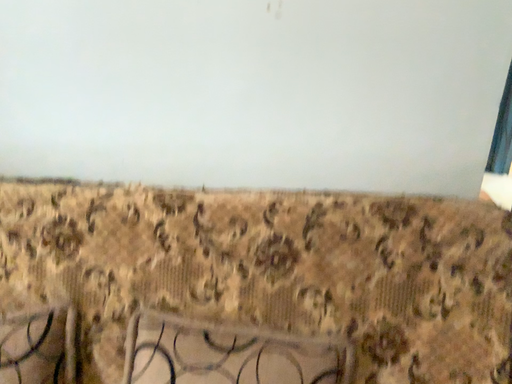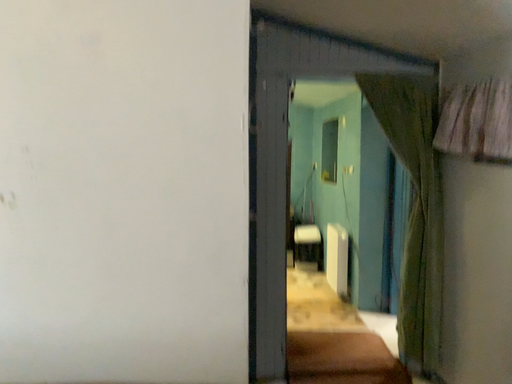
Question: How did the camera likely rotate when shooting the video?

Choices:
 (A) rotated upward
 (B) rotated downward

Answer: (A)